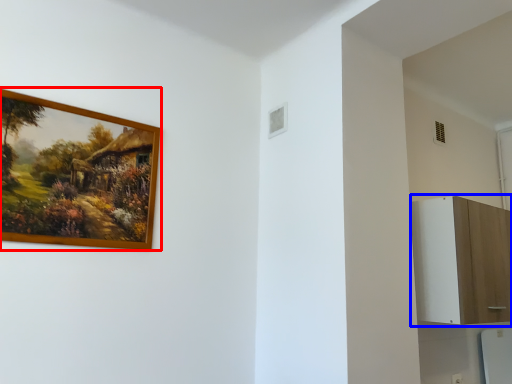
Question: Which of the following is the closest to the observer, picture frame (highlighted by a red box) or dresser (highlighted by a blue box)?

Choices:
 (A) picture frame
 (B) dresser

Answer: (A)